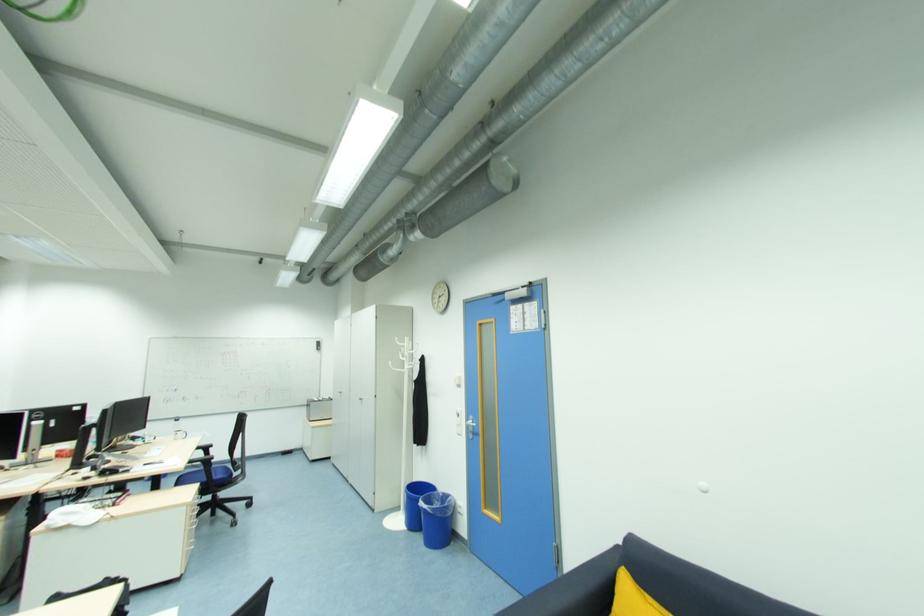
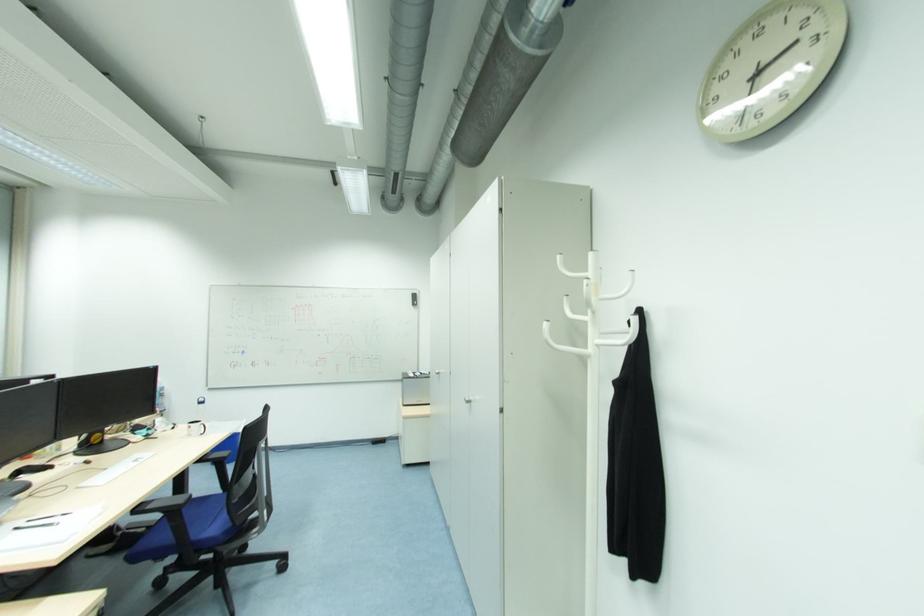
The point at (409, 368) is marked in the first image. Where is the corresponding point in the second image?

(596, 341)